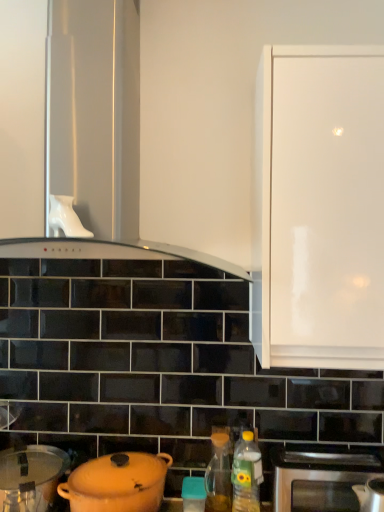
Question: Is white glossy range hood at upper center taller or shorter than matte plastic container at center?

Choices:
 (A) short
 (B) tall

Answer: (B)

Question: Considering the positions of white glossy range hood at upper center and matte plastic container at center in the image, is white glossy range hood at upper center bigger or smaller than matte plastic container at center?

Choices:
 (A) small
 (B) big

Answer: (B)

Question: Estimate the real-world distances between objects in this image. Which object is farther from the matte orange pot at lower left, the third kitchen appliance from the right?

Choices:
 (A) white glossy range hood at upper center
 (B) translucent plastic bottle at lower right, which is the 2th bottle in left-to-right order
 (C) white glossy cabinet at upper right
 (D) stainless steel oven at lower right
 (E) translucent glass oil at lower center, which is the first bottle from back to front

Answer: (C)

Question: Estimate the real-world distances between objects in this image. Which object is closer to the stainless steel kettle at lower right, which ranks as the third kitchen appliance in left-to-right order?

Choices:
 (A) translucent plastic bottle at lower right, which appears as the 1th bottle when viewed from the front
 (B) white glossy cabinet at upper right
 (C) matte plastic container at center
 (D) white glossy range hood at upper center
 (E) translucent glass oil at lower center, which is counted as the second bottle, starting from the front

Answer: (A)